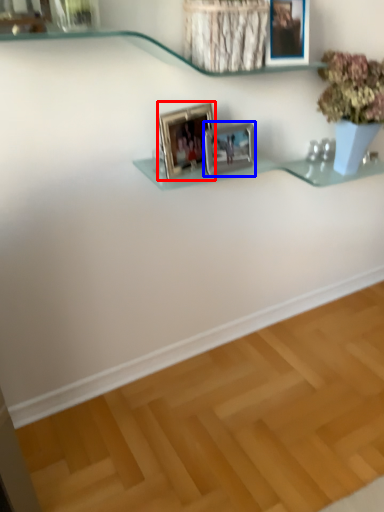
Question: Which object appears closest to the camera in this image, picture frame (highlighted by a red box) or picture frame (highlighted by a blue box)?

Choices:
 (A) picture frame
 (B) picture frame

Answer: (A)